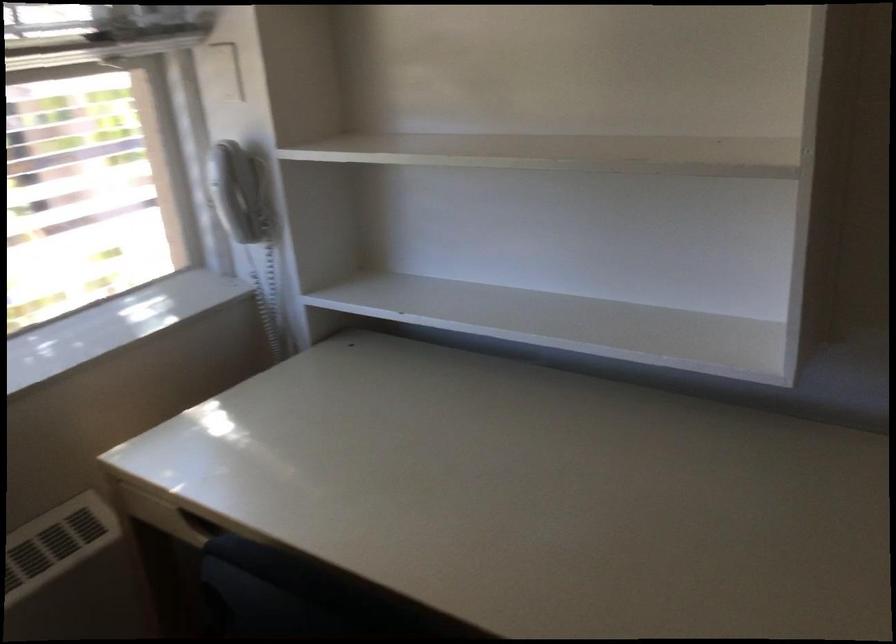
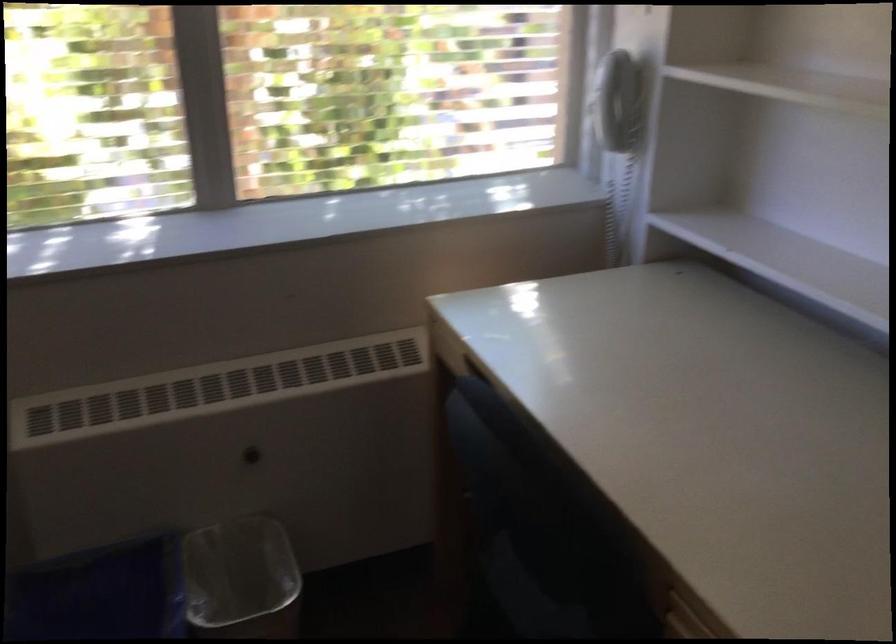
Question: The camera is either moving clockwise (left) or counter-clockwise (right) around the object. The first image is from the beginning of the video and the second image is from the end. Is the camera moving left or right when shooting the video?

Choices:
 (A) Left
 (B) Right

Answer: (B)